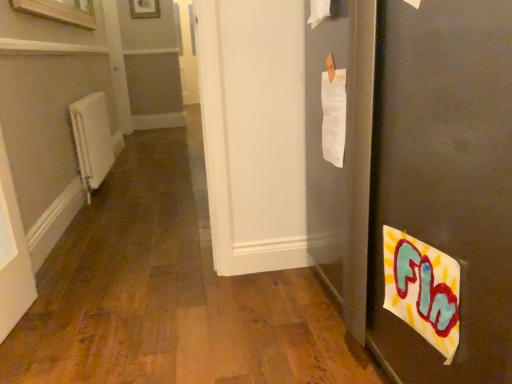
Where is `vacant area that is in front of white matte radiator at left`? This screenshot has width=512, height=384. vacant area that is in front of white matte radiator at left is located at coordinates (116, 206).